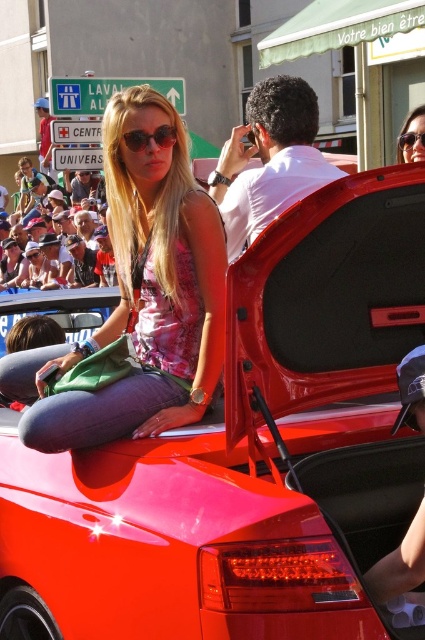
What do you see at coordinates (269, 161) in the screenshot?
I see `white matte shirt at center` at bounding box center [269, 161].

Who is shorter, white matte shirt at center or matte black sunglasses at center?

Standing shorter between the two is matte black sunglasses at center.

Between point (294, 109) and point (150, 132), which one is positioned behind?

Point (294, 109)

This screenshot has height=640, width=425. In order to click on white matte shirt at center in this screenshot , I will do `click(269, 161)`.

You are a GUI agent. You are given a task and a screenshot of the screen. Output one action in this format:
    pyautogui.click(x=<x>, y=<y>)
    Task: Click on the pink fabric dress at center
    Image resolution: width=425 pixels, height=640 pixels.
    Given the screenshot: What is the action you would take?
    pyautogui.click(x=142, y=294)

Who is more forward, (39, 369) or (159, 131)?

Point (159, 131) is in front.

This screenshot has height=640, width=425. What are the coordinates of `pink fabric dress at center` in the screenshot? It's located at tap(142, 294).

Identify the location of pink fabric dress at center. Image resolution: width=425 pixels, height=640 pixels. (142, 294).

Does white plastic cups at upper left have a greater height compared to matte black sunglasses at center?

Yes, white plastic cups at upper left is taller than matte black sunglasses at center.

Between point (39, 285) and point (141, 132), which one is positioned behind?

Positioned behind is point (39, 285).

Identify the location of white plastic cups at upper left. The height and width of the screenshot is (640, 425). (73, 280).